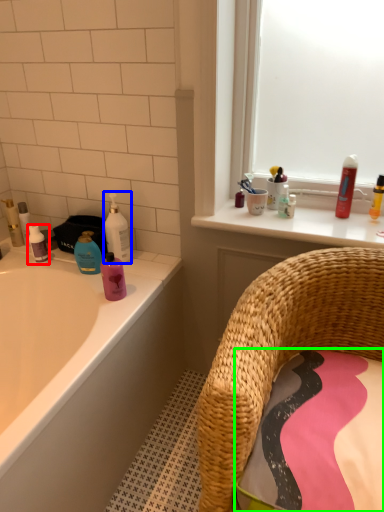
Question: Which object is positioned farthest from mouthwash (highlighted by a red box)? Select from cleaning product (highlighted by a blue box) and bath towel (highlighted by a green box).

Choices:
 (A) cleaning product
 (B) bath towel

Answer: (B)